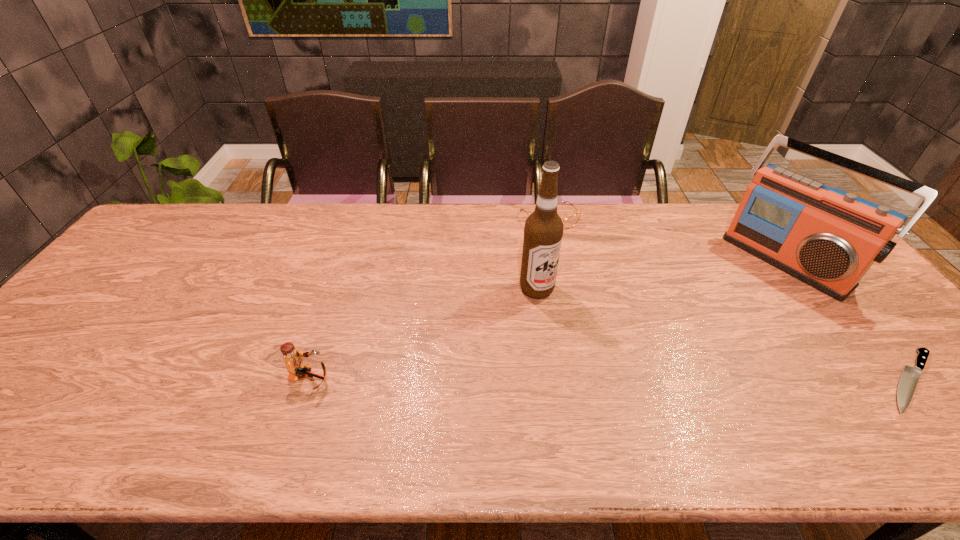
Locate an element on the screen. This screenshot has width=960, height=540. vacant region located 0.350m on the label of the tallest object is located at coordinates (664, 376).

Find the location of `free space located on the label of the tallest object`. free space located on the label of the tallest object is located at coordinates [676, 384].

Identify the location of free space located 0.360m on the front-facing side of the fourth shortest object. click(x=688, y=345).

Find the location of a particular element. free region located 0.100m on the front-facing side of the fourth shortest object is located at coordinates (744, 300).

At what (x,y) coordinates should I click in order to perform the action: click on free space located 0.390m on the front-facing side of the fourth shortest object. Please return your answer as a coordinate pair (x, y). The image size is (960, 540). Looking at the image, I should click on (682, 350).

Image resolution: width=960 pixels, height=540 pixels. Identify the location of spectacles at the far edge. (569, 222).

You are a GUI agent. You are given a task and a screenshot of the screen. Output one action in this format:
    pyautogui.click(x=<x>, y=<y>)
    Task: Click on the radio receiver located in the far edge section of the desktop
    This screenshot has width=960, height=540.
    Given the screenshot: What is the action you would take?
    pyautogui.click(x=828, y=238)

At what (x,y) coordinates should I click in order to perform the action: click on object that is at the near edge. Please return your answer as a coordinate pair (x, y). Looking at the image, I should click on (296, 367).

Image resolution: width=960 pixels, height=540 pixels. Find the location of `object present at the right edge`. object present at the right edge is located at coordinates (828, 238).

Locate an element on the screen. object located in the far right corner section of the desktop is located at coordinates (828, 238).